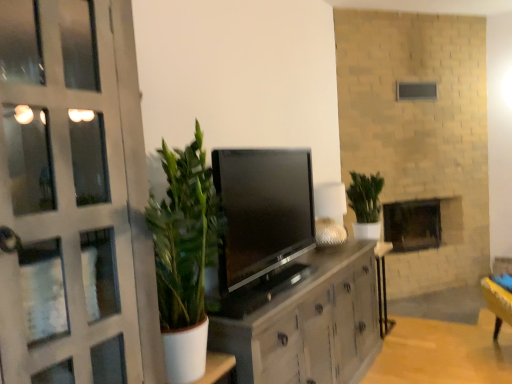
Question: Is matte white door at left situated inside wooden table at center or outside?

Choices:
 (A) outside
 (B) inside

Answer: (A)

Question: From a real-world perspective, relative to wooden table at center, is matte white door at left vertically above or below?

Choices:
 (A) above
 (B) below

Answer: (A)

Question: Considering the real-world distances, which object is farthest from the brick fireplace at center?

Choices:
 (A) matte white cabinet at center
 (B) matte white door at left
 (C) wooden table at center
 (D) green leafy plant at center
 (E) satin black tv at center

Answer: (B)

Question: Estimate the real-world distances between objects in this image. Which object is closer to the wooden table at center?

Choices:
 (A) satin black tv at center
 (B) matte white cabinet at center
 (C) green leafy plant at center
 (D) matte white door at left
 (E) brick fireplace at center

Answer: (C)